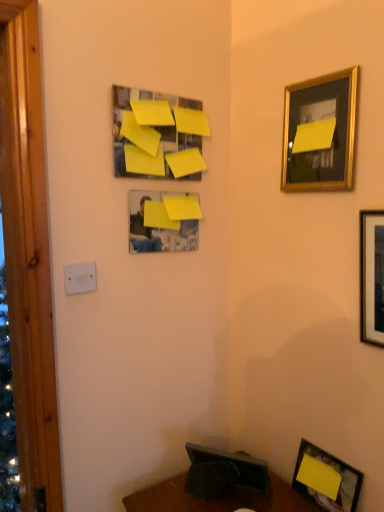
Question: From a real-world perspective, is gold metallic picture frame at upper right, positioned as the 2th picture frame in top-to-bottom order, below yellow paper at upper center, which is the 5th picture frame from right to left?

Choices:
 (A) no
 (B) yes

Answer: (B)

Question: From a real-world perspective, does gold metallic picture frame at upper right, positioned as the 2th picture frame in top-to-bottom order, stand above yellow paper at upper center, the 1th picture frame viewed from the left?

Choices:
 (A) no
 (B) yes

Answer: (A)

Question: Does gold metallic picture frame at upper right, arranged as the third picture frame when viewed from the right, contain yellow paper at upper center, positioned as the first picture frame in top-to-bottom order?

Choices:
 (A) yes
 (B) no

Answer: (B)

Question: Is gold metallic picture frame at upper right, positioned as the 2th picture frame in top-to-bottom order, to the left of yellow paper at upper center, the 1th picture frame viewed from the left, from the viewer's perspective?

Choices:
 (A) yes
 (B) no

Answer: (B)

Question: Is there a large distance between gold metallic picture frame at upper right, arranged as the third picture frame when viewed from the right, and yellow paper at upper center, which is the 5th picture frame from right to left?

Choices:
 (A) no
 (B) yes

Answer: (A)

Question: Considering the relative positions of gold metallic picture frame at upper right, which is counted as the third picture frame, starting from the left, and yellow paper at upper center, the 1th picture frame viewed from the left, in the image provided, is gold metallic picture frame at upper right, which is counted as the third picture frame, starting from the left, to the right of yellow paper at upper center, the 1th picture frame viewed from the left, from the viewer's perspective?

Choices:
 (A) no
 (B) yes

Answer: (B)

Question: Does gold metallic picture frame at upper right, the 4th picture frame from the bottom, have a smaller size compared to white plastic/light switch at lower left?

Choices:
 (A) no
 (B) yes

Answer: (A)

Question: Is gold metallic picture frame at upper right, which is counted as the third picture frame, starting from the left, at the right side of white plastic/light switch at lower left?

Choices:
 (A) yes
 (B) no

Answer: (A)

Question: Is gold metallic picture frame at upper right, the 4th picture frame from the bottom, placed right next to white plastic/light switch at lower left?

Choices:
 (A) no
 (B) yes

Answer: (A)

Question: Is gold metallic picture frame at upper right, the 4th picture frame from the bottom, positioned beyond the bounds of white plastic/light switch at lower left?

Choices:
 (A) yes
 (B) no

Answer: (A)

Question: Does gold metallic picture frame at upper right, positioned as the 2th picture frame in top-to-bottom order, have a greater height compared to white plastic/light switch at lower left?

Choices:
 (A) yes
 (B) no

Answer: (A)

Question: From the image's perspective, is gold metallic picture frame at upper right, which is counted as the third picture frame, starting from the left, over white plastic/light switch at lower left?

Choices:
 (A) yes
 (B) no

Answer: (A)

Question: Is yellow matte picture frame at upper center, which ranks as the 3th picture frame in bottom-to-top order, at the left side of yellow matte paper at lower right, the 4th picture frame viewed from the left?

Choices:
 (A) no
 (B) yes

Answer: (B)